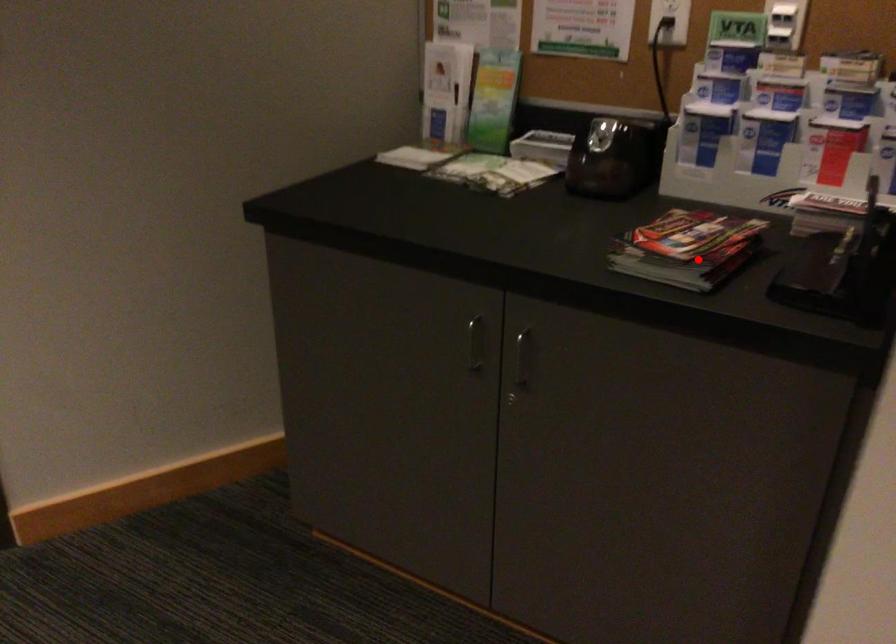
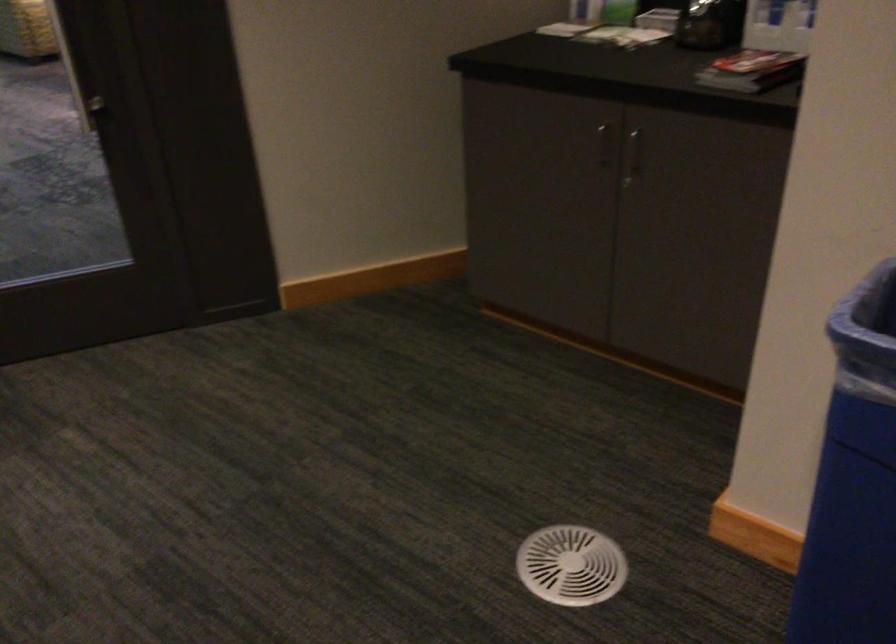
Find the pixel in the second image that matches the highlighted location in the first image.

(751, 71)